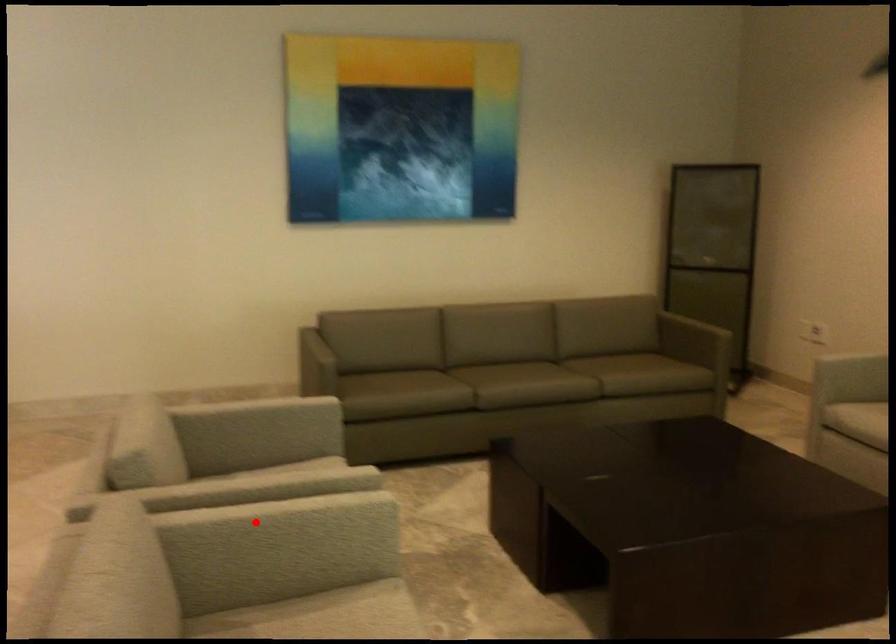
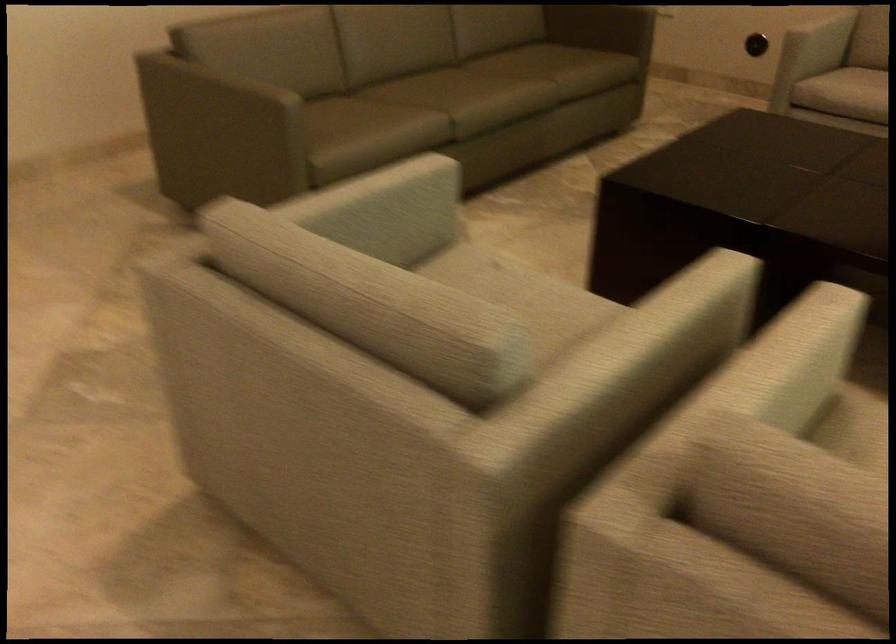
Question: I am providing you with two images of the same scene from different viewpoints. A red point is marked on the first image. Can you still see the location of the red point in image 2?

Choices:
 (A) Yes
 (B) No

Answer: (A)